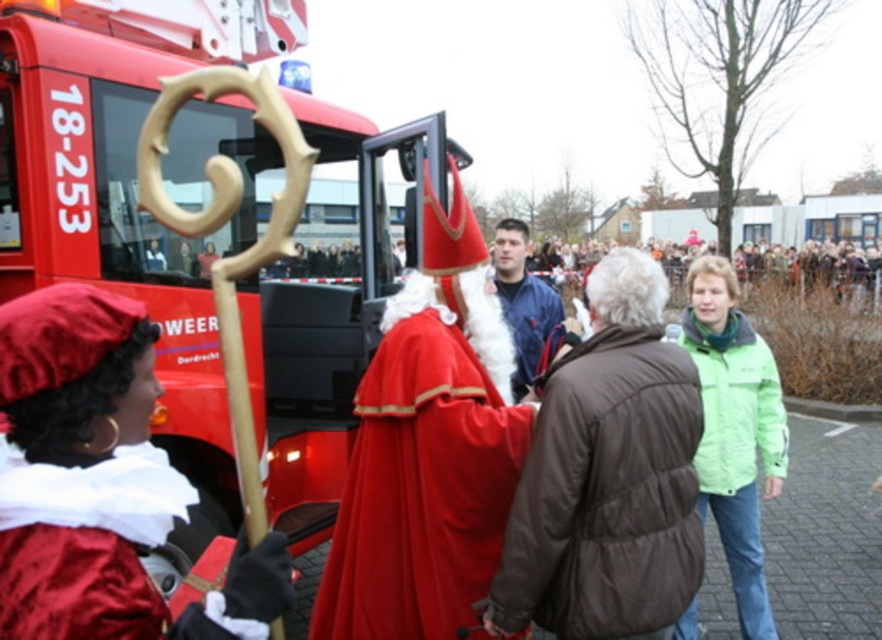
Which is in front, point (428, 273) or point (618, 532)?

Point (618, 532) is more forward.

Which is more to the right, velvet red robe at center or brown puffy jacket at center?

From the viewer's perspective, brown puffy jacket at center appears more on the right side.

Is point (462, 561) less distant than point (621, 496)?

No, (462, 561) is further to viewer.

At what (x,y) coordinates should I click in order to perform the action: click on velvet red robe at center. Please return your answer as a coordinate pair (x, y). Looking at the image, I should click on tap(428, 449).

Who is more forward, (281, 355) or (28, 522)?

Point (28, 522)

Between red matte fire truck at upper left and velvet red cape at center, which one has less height?

Standing shorter between the two is velvet red cape at center.

What do you see at coordinates (129, 211) in the screenshot? I see `red matte fire truck at upper left` at bounding box center [129, 211].

Find the location of a particular element. The height and width of the screenshot is (640, 882). red matte fire truck at upper left is located at coordinates (129, 211).

Which is in front, point (625, 461) or point (742, 269)?

Point (625, 461) is more forward.

Does brown puffy jacket at center come behind green fabric crowd at upper center?

No, brown puffy jacket at center is in front of green fabric crowd at upper center.

Is point (623, 540) closer to camera compared to point (861, 292)?

Yes.

The height and width of the screenshot is (640, 882). I want to click on brown puffy jacket at center, so click(606, 493).